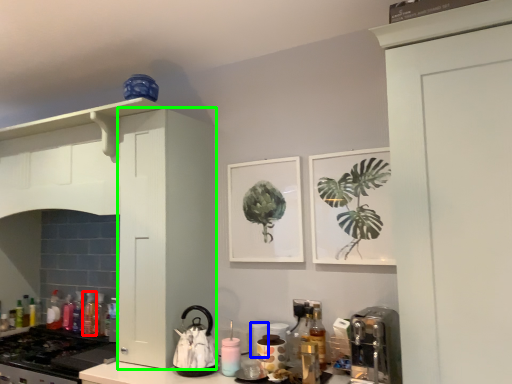
Question: Which is farther away from bottle (highlighted by a red box)? appliance (highlighted by a blue box) or cabinetry (highlighted by a green box)?

Choices:
 (A) appliance
 (B) cabinetry

Answer: (A)